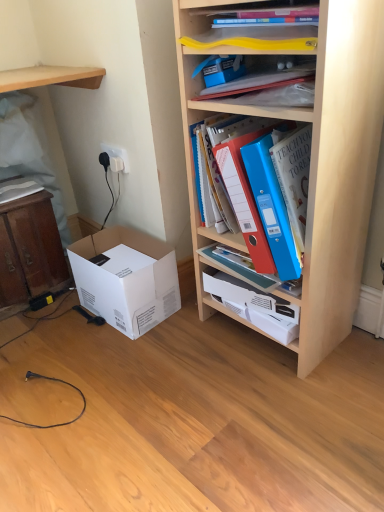
Where is `vacant space situated above wooden cabinet at left (from a real-world perspective)`? This screenshot has width=384, height=512. vacant space situated above wooden cabinet at left (from a real-world perspective) is located at coordinates [15, 189].